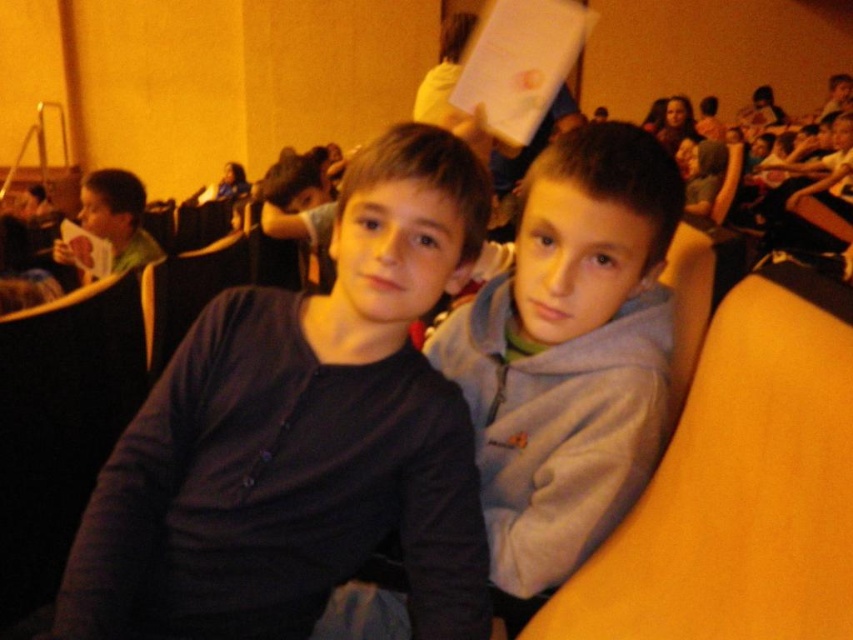
Question: Which object is farther from the camera taking this photo?

Choices:
 (A) dark blue shirt at center
 (B) matte black hair at upper center
 (C) blue fabric shirt at upper left

Answer: (C)

Question: Does matte black hair at upper center appear over blue fabric shirt at upper left?

Choices:
 (A) no
 (B) yes

Answer: (B)

Question: Which of the following is the farthest from the observer?

Choices:
 (A) matte black hair at upper center
 (B) matte green sweater at left
 (C) dark blue sweater at center
 (D) dark blue shirt at center

Answer: (A)

Question: Considering the relative positions of dark blue sweater at center and matte black hair at upper center in the image provided, where is dark blue sweater at center located with respect to matte black hair at upper center?

Choices:
 (A) left
 (B) right

Answer: (A)

Question: Which of these objects is positioned closest to the dark blue shirt at center?

Choices:
 (A) dark blue sweater at center
 (B) matte green sweater at left

Answer: (A)

Question: Is dark blue sweater at center smaller than blue fabric shirt at upper left?

Choices:
 (A) no
 (B) yes

Answer: (B)